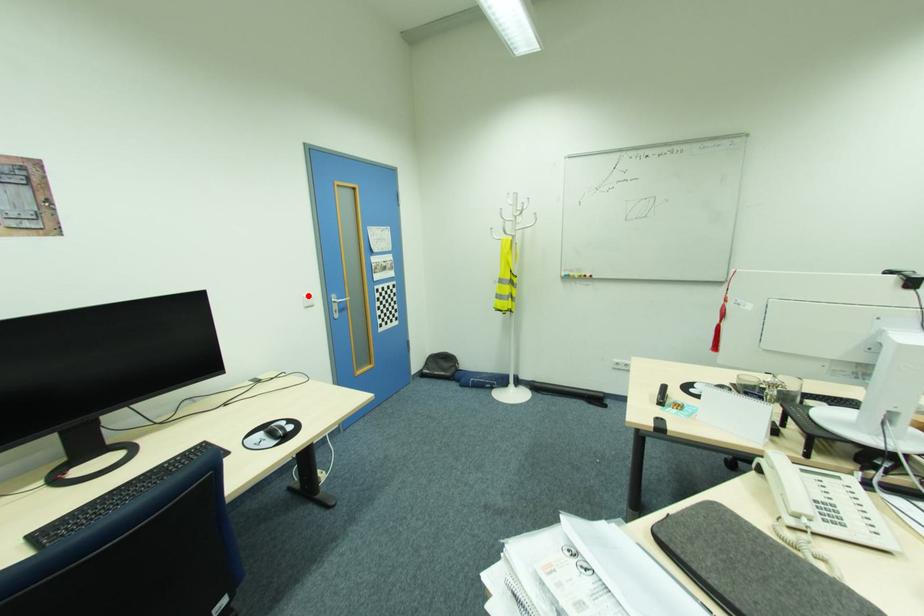
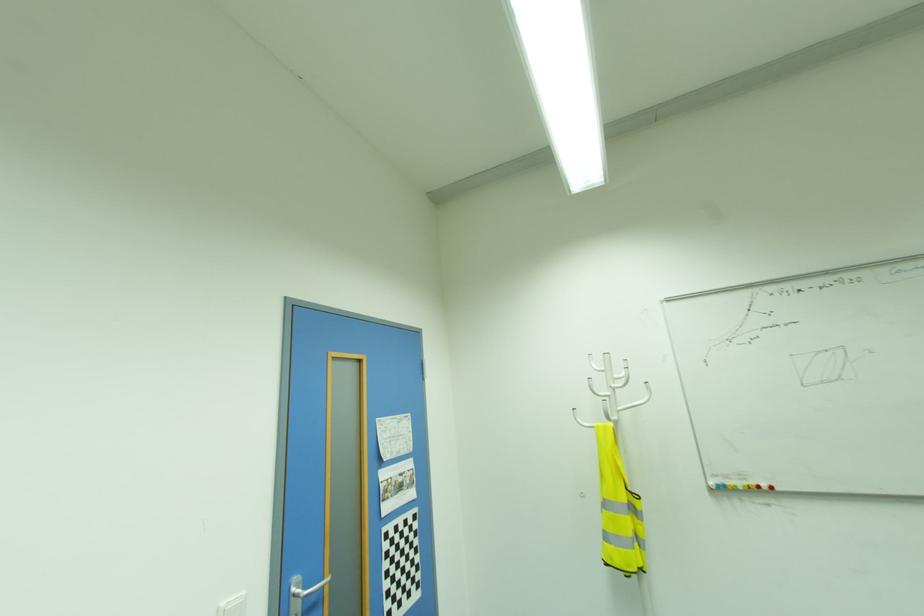
In the second image, find the point that corresponds to the highlighted location in the first image.

(226, 602)